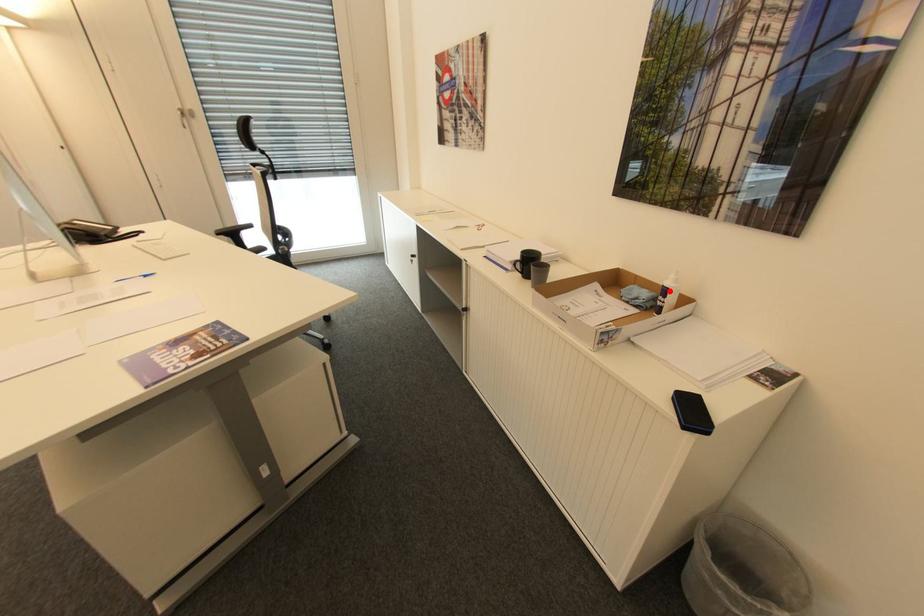
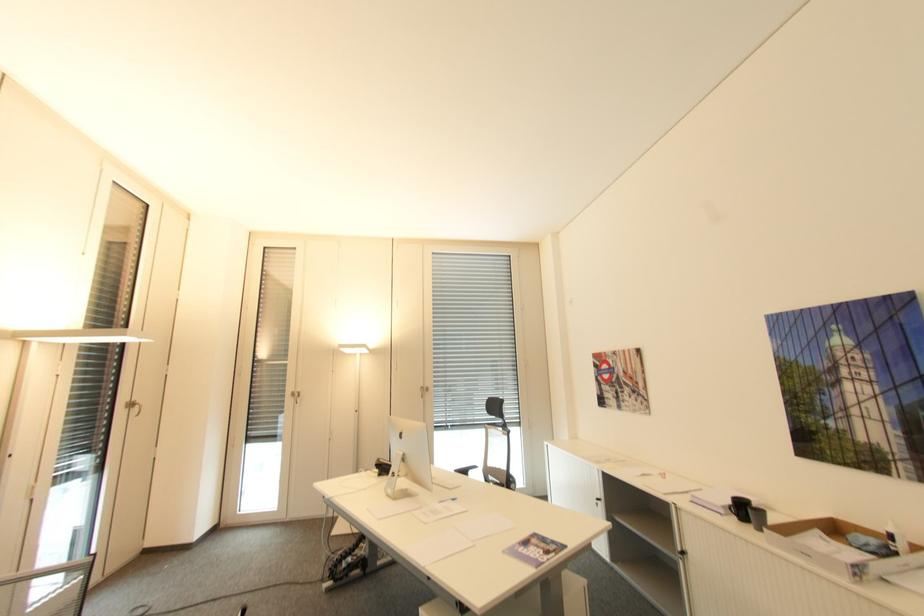
In the second image, find the point that corresponds to the highlighted location in the first image.

(895, 537)